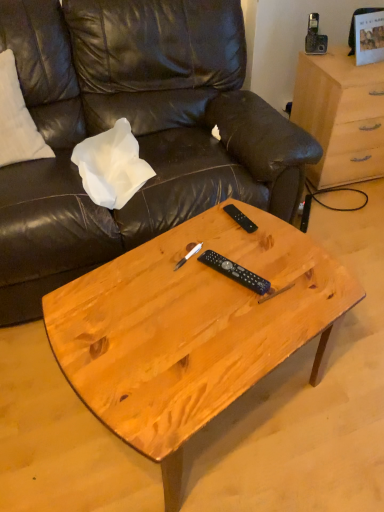
Locate an element on the screen. unoccupied region to the right of black plastic remote at center, which is the 2th remote in front-to-back order is located at coordinates (279, 231).